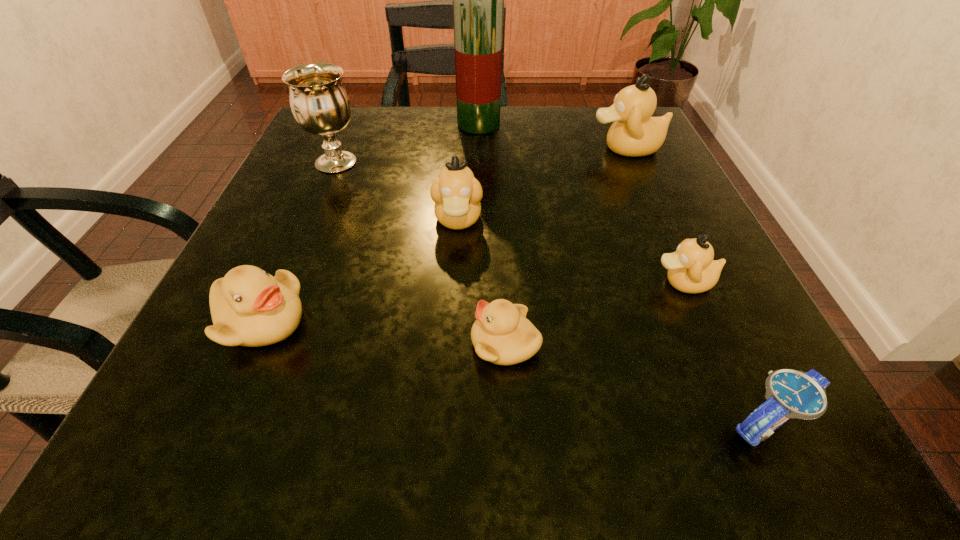
Where is `the shortest duckling`? the shortest duckling is located at coordinates [502, 334].

You are a GUI agent. You are given a task and a screenshot of the screen. Output one action in this format:
    pyautogui.click(x=<x>, y=<y>)
    Task: Click on the smaller yellow duckling
    Image resolution: width=960 pixels, height=540 pixels.
    Given the screenshot: What is the action you would take?
    pyautogui.click(x=502, y=334)

Find the location of `the nearest object`. the nearest object is located at coordinates (789, 393).

You are a GUI agent. You are given a task and a screenshot of the screen. Output one action in this format:
    pyautogui.click(x=<x>, y=<y>)
    Task: Click on the watch
    The width and height of the screenshot is (960, 540).
    Given the screenshot: What is the action you would take?
    pyautogui.click(x=789, y=393)

Locate an element on the screen. Image resolution: width=960 pixels, height=540 pixels. vacant space located 0.300m on the front of the tallest object is located at coordinates (478, 224).

Identify the location of free space located 0.330m on the right of the chalice. (529, 163).

Where is `vacant position located 0.070m on the face of the biggest tan duckling`? vacant position located 0.070m on the face of the biggest tan duckling is located at coordinates (556, 148).

I want to click on blank space located 0.370m on the face of the biggest tan duckling, so click(x=411, y=148).

Locate an element on the screen. This screenshot has width=960, height=540. free space located 0.340m on the face of the biggest tan duckling is located at coordinates pyautogui.click(x=425, y=148).

Where is `free point located on the face of the leftmost tan duckling`? This screenshot has width=960, height=540. free point located on the face of the leftmost tan duckling is located at coordinates (448, 403).